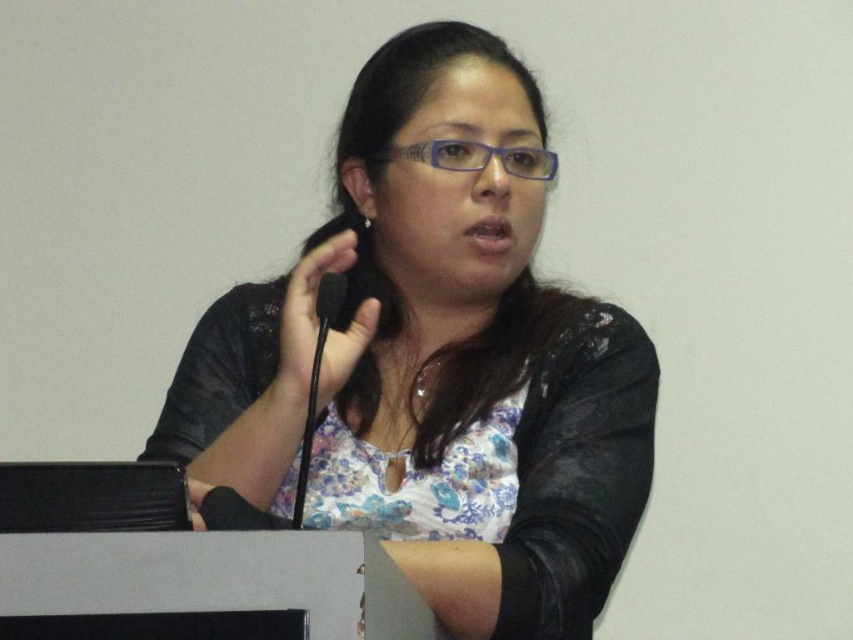
You are a photographer adjusting your camera settings to capture the woman at the podium. You notice two points in the scene at coordinates point (531, 582) and point (314, 404). Which point should you focus on first if you want to ensure the woman is in sharp focus?

You should focus on point (314, 404) first because it is closer to the camera than point (531, 582). Since the woman is at the podium, focusing on the closer point will ensure her face and upper body are in sharp focus.

You are an event organizer setting up for a presentation. You need to adjust the podium so that the black matte microphone at center is closer to the audience than the matte black jacket at center. Based on the current setup, is the microphone already positioned correctly?

The matte black jacket at center is closer to the viewer than the black matte microphone at center, so the microphone is not positioned correctly. To adjust, move the microphone forward so it is closer to the audience than the jacket.